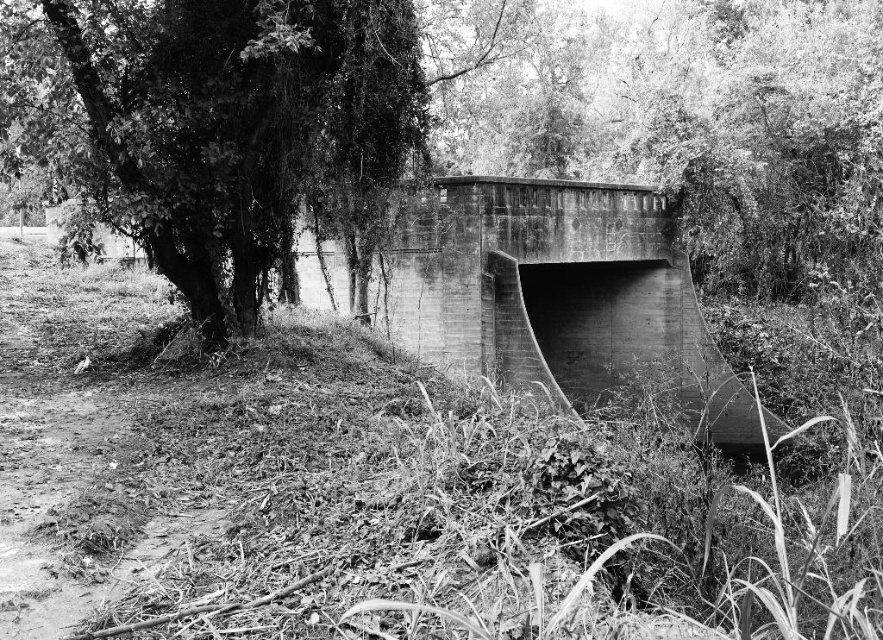
This screenshot has height=640, width=883. What do you see at coordinates (220, 129) in the screenshot? I see `green leafy tree at left` at bounding box center [220, 129].

Does point (172, 104) come in front of point (442, 227)?

Yes, point (172, 104) is closer to viewer.

What do you see at coordinates (220, 129) in the screenshot? I see `green leafy tree at left` at bounding box center [220, 129].

This screenshot has height=640, width=883. Find the location of `green leafy tree at left`. green leafy tree at left is located at coordinates (220, 129).